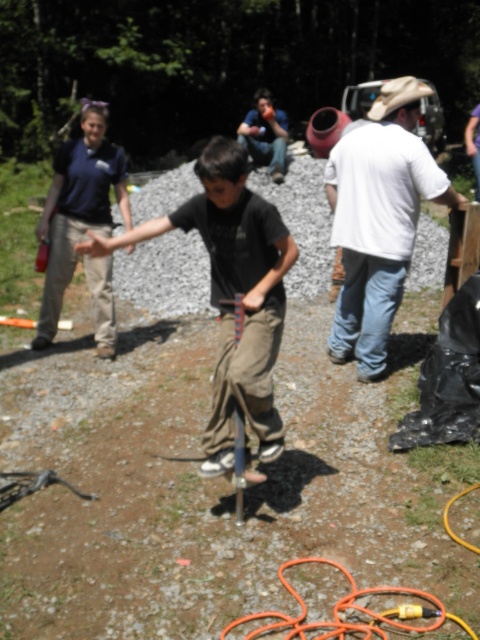
Based on the photo, is matte black shirt at center in front of white cotton shirt at right?

That is True.

Can you confirm if matte black shirt at center is positioned below white cotton shirt at right?

No.

Between point (255, 364) and point (352, 227), which one is positioned in front?

Point (255, 364) is in front.

Identify the location of matte black shirt at center. (231, 292).

Between point (354, 356) and point (422, 593), which one is positioned behind?

The point (354, 356) is more distant.

Can you confirm if white cotton shirt at right is positioned to the right of orange rubber hose at lower center?

Yes, white cotton shirt at right is to the right of orange rubber hose at lower center.

Which is in front, point (358, 193) or point (427, 609)?

Point (427, 609) is in front.

In order to click on white cotton shirt at right in this screenshot , I will do `click(379, 220)`.

Measure the distance from matte black shirt at center to orange rubber hose at lower center.

38.80 inches

Which of these two, matte black shirt at center or orange rubber hose at lower center, stands shorter?

With less height is orange rubber hose at lower center.

Who is more distant from viewer, [266,388] or [314,556]?

The point [266,388] is more distant.

This screenshot has width=480, height=640. I want to click on matte black shirt at center, so click(231, 292).